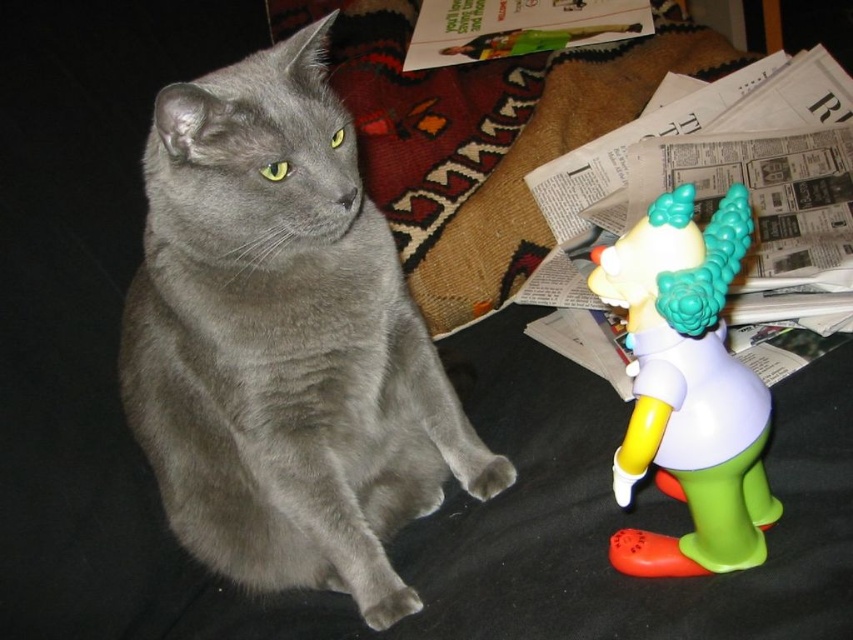
Who is more forward, (289, 284) or (740, 451)?

Point (740, 451) is more forward.

Is point (350, 403) more distant than point (763, 508)?

Yes, it is.

Identify the location of matte gray cat at center. The height and width of the screenshot is (640, 853). (283, 340).